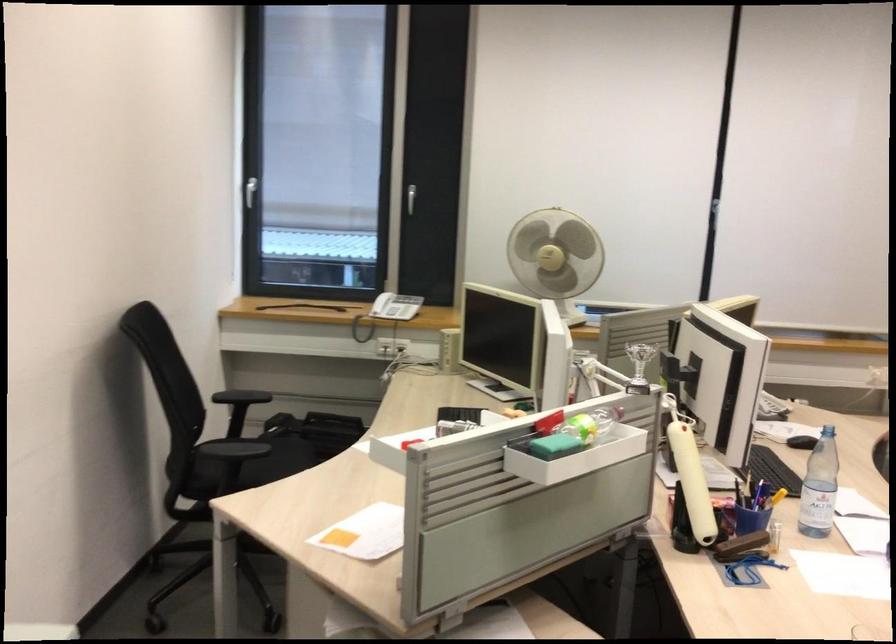
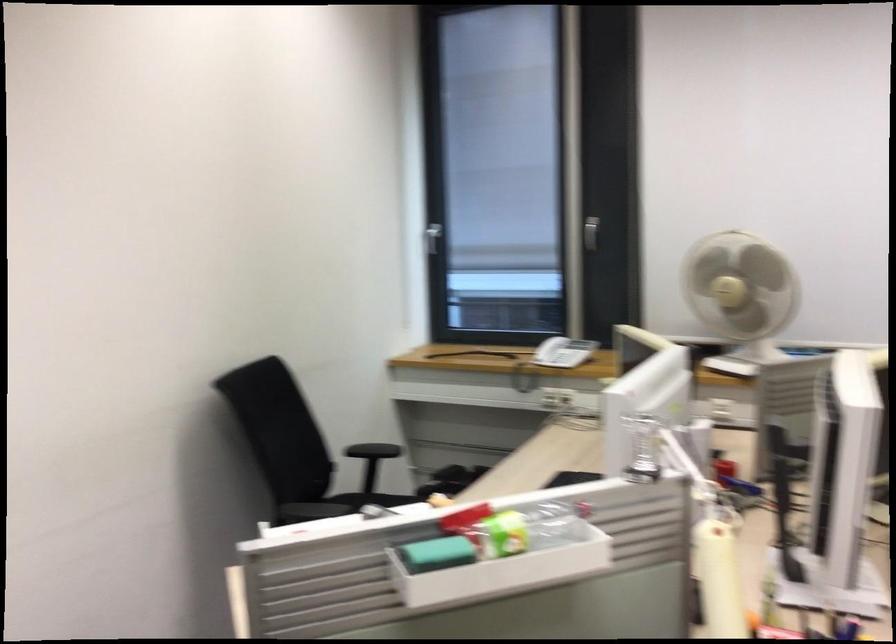
Question: I am providing you with two images of the same scene from different viewpoints. Please identify which objects are invisible in image2.

Choices:
 (A) green sponge
 (B) telephone handset
 (C) black chair armrest
 (D) black hanger clip

Answer: (C)